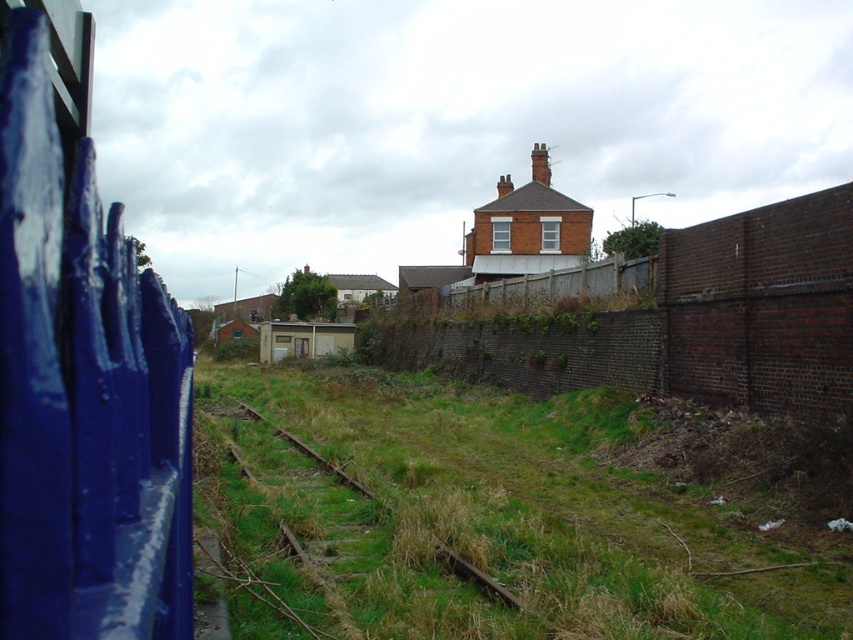
Does point (834, 296) come behind point (334, 474)?

That is False.

Who is positioned more to the right, brick wall at center or green grassy train track at center?

Positioned to the right is brick wall at center.

Is point (804, 369) positioned before point (289, 435)?

Yes, point (804, 369) is in front of point (289, 435).

The height and width of the screenshot is (640, 853). I want to click on brick wall at center, so [x=685, y=321].

Does point (160, 432) come closer to viewer compared to point (456, 572)?

Yes, point (160, 432) is closer to viewer.

Is the position of blue painted wood fence at left more distant than that of green grassy train track at center?

No, it is not.

Where is `blue painted wood fence at left`? The image size is (853, 640). blue painted wood fence at left is located at coordinates (82, 371).

Where is `blue painted wood fence at left`? Image resolution: width=853 pixels, height=640 pixels. blue painted wood fence at left is located at coordinates (82, 371).

Who is more distant from viewer, (129, 518) or (393, 333)?

Positioned behind is point (393, 333).

Is point (169, 509) in front of point (839, 358)?

Yes, point (169, 509) is in front of point (839, 358).

The image size is (853, 640). What are the coordinates of `blue painted wood fence at left` in the screenshot? It's located at (82, 371).